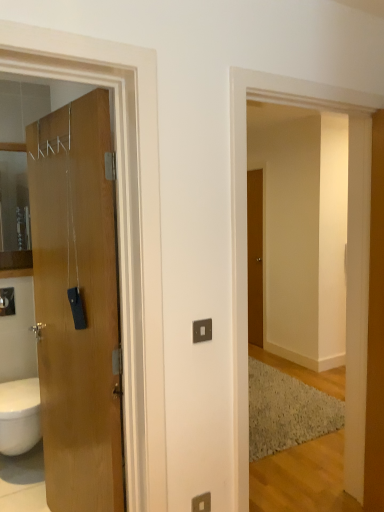
Question: Is brown wooden door at center, which appears as the first door when viewed from the right, turned away from matte silver switch at lower center?

Choices:
 (A) yes
 (B) no

Answer: (B)

Question: Is the depth of brown wooden door at center, the second door positioned from the front, greater than that of matte silver switch at lower center?

Choices:
 (A) yes
 (B) no

Answer: (A)

Question: From the image's perspective, is brown wooden door at center, the second door positioned from the front, over matte silver switch at lower center?

Choices:
 (A) yes
 (B) no

Answer: (A)

Question: Considering the relative positions of brown wooden door at center, which appears as the first door when viewed from the right, and matte silver switch at lower center in the image provided, is brown wooden door at center, which appears as the first door when viewed from the right, to the right of matte silver switch at lower center from the viewer's perspective?

Choices:
 (A) no
 (B) yes

Answer: (B)

Question: Can you confirm if brown wooden door at center, the 2th door from the left, is shorter than matte silver switch at lower center?

Choices:
 (A) no
 (B) yes

Answer: (A)

Question: Is brown wooden door at center, the 2th door from the left, facing towards matte silver switch at lower center?

Choices:
 (A) yes
 (B) no

Answer: (B)

Question: Is brown wooden door at center, the second door positioned from the front, bigger than wooden pillar at right?

Choices:
 (A) yes
 (B) no

Answer: (B)

Question: Considering the relative positions of brown wooden door at center, the 2th door from the left, and wooden pillar at right in the image provided, is brown wooden door at center, the 2th door from the left, behind wooden pillar at right?

Choices:
 (A) yes
 (B) no

Answer: (A)

Question: Does brown wooden door at center, the 2th door from the left, have a greater height compared to wooden pillar at right?

Choices:
 (A) no
 (B) yes

Answer: (A)

Question: Is brown wooden door at center, the second door positioned from the front, completely or partially outside of wooden pillar at right?

Choices:
 (A) no
 (B) yes

Answer: (B)

Question: Considering the relative sizes of brown wooden door at center, which appears as the first door when viewed from the right, and wooden pillar at right in the image provided, is brown wooden door at center, which appears as the first door when viewed from the right, smaller than wooden pillar at right?

Choices:
 (A) yes
 (B) no

Answer: (A)

Question: Does brown wooden door at center, the second door positioned from the front, contain wooden pillar at right?

Choices:
 (A) no
 (B) yes

Answer: (A)

Question: From the image's perspective, is wooden pillar at right on wooden door at left, the 2th door positioned from the right?

Choices:
 (A) no
 (B) yes

Answer: (B)